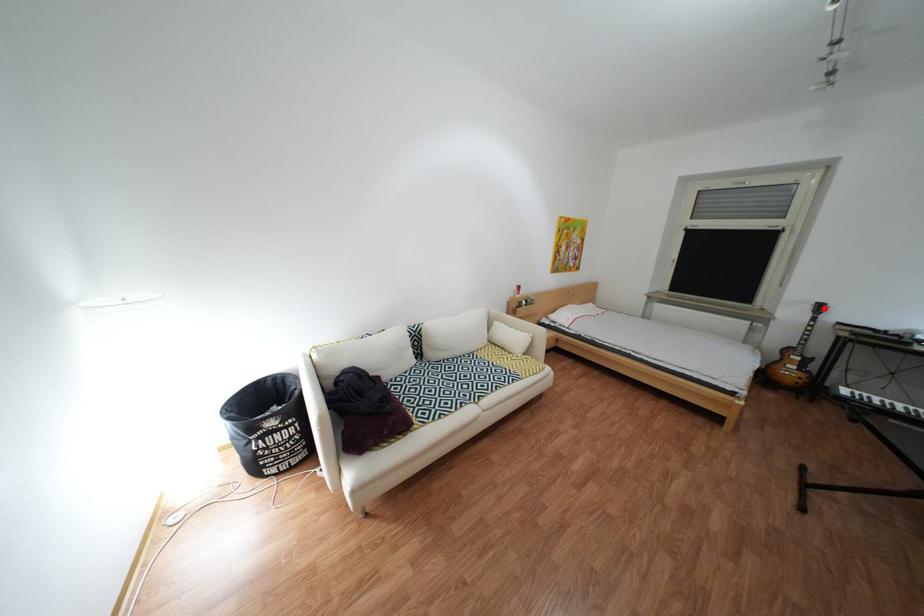
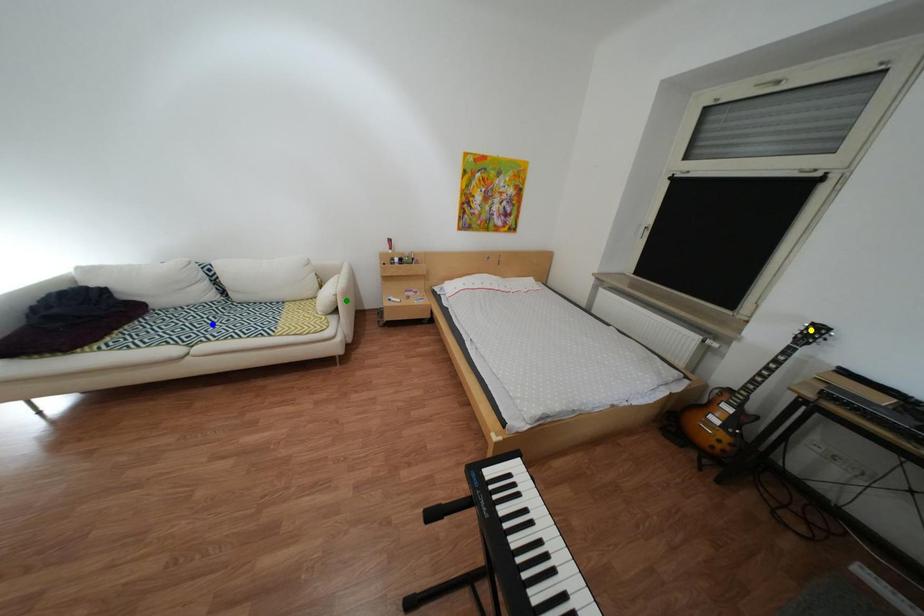
Question: I am providing you with two images of the same scene from different viewpoints. A red point is marked on the first image. You are given multiple points on the second image. In image 2, which mark is for the same physical point as the one in image 1?

Choices:
 (A) green point
 (B) yellow point
 (C) blue point

Answer: (B)